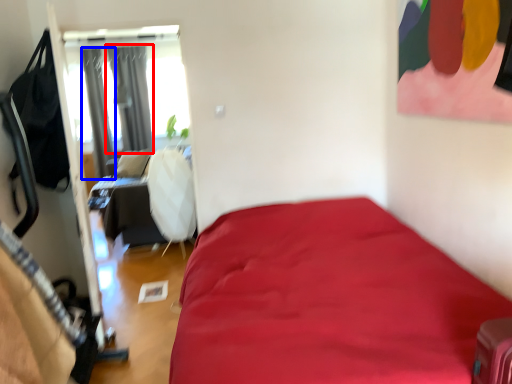
Question: Which point is closer to the camera, curtain (highlighted by a red box) or curtain (highlighted by a blue box)?

Choices:
 (A) curtain
 (B) curtain

Answer: (B)